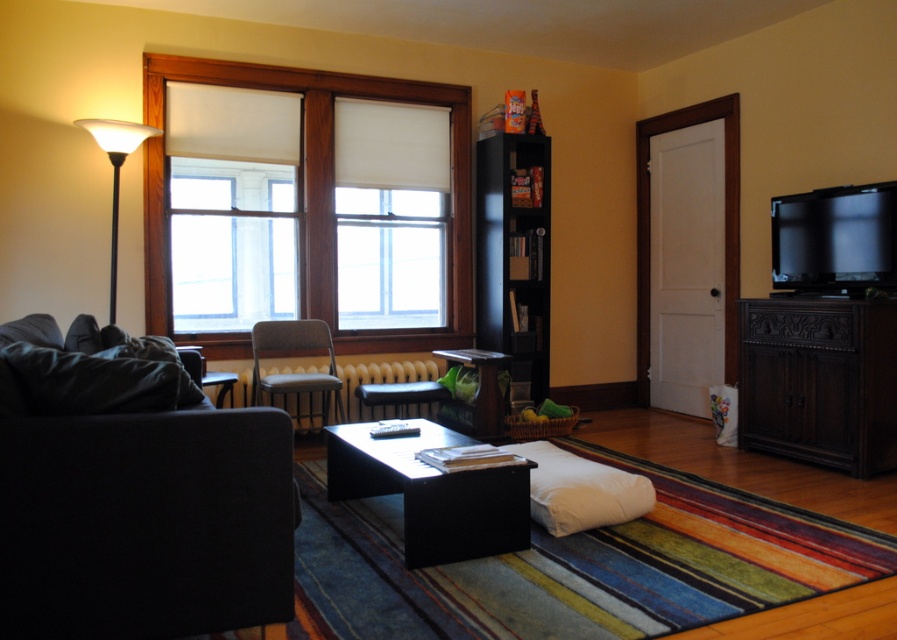
Question: Does dark gray fabric couch at left appear on the left side of white frosted glass floor lamp at left?

Choices:
 (A) no
 (B) yes

Answer: (A)

Question: Can you confirm if white matte window at upper left is bigger than dark green fabric pillow at lower left?

Choices:
 (A) no
 (B) yes

Answer: (B)

Question: Estimate the real-world distances between objects in this image. Which object is closer to the dark gray fabric couch at left?

Choices:
 (A) white matte window at upper left
 (B) black matte coffee table at center
 (C) dark wood cabinet at right
 (D) dark green fabric pillow at lower left

Answer: (D)

Question: Which point appears closest to the camera in this image?

Choices:
 (A) (469, 256)
 (B) (848, 301)

Answer: (B)

Question: Which point is farther to the camera?

Choices:
 (A) (503, 244)
 (B) (92, 381)
 (C) (45, 579)
 (D) (111, 273)

Answer: (A)

Question: Does dark gray fabric couch at left have a larger size compared to white frosted glass floor lamp at left?

Choices:
 (A) yes
 (B) no

Answer: (B)